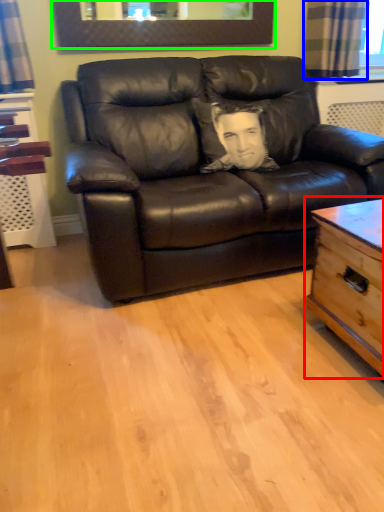
Question: Considering the real-world distances, which object is farthest from table (highlighted by a red box)? curtain (highlighted by a blue box) or picture frame (highlighted by a green box)?

Choices:
 (A) curtain
 (B) picture frame

Answer: (B)